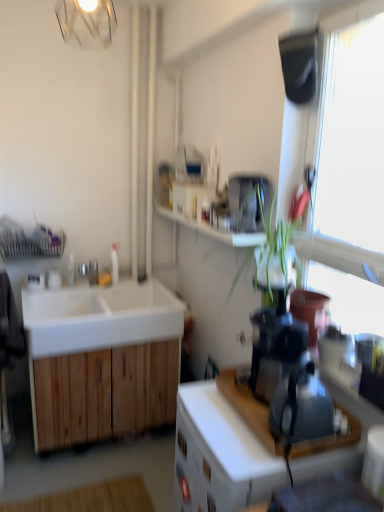
Question: Is white wood cabinet at left, the 1th cabinetry viewed from the back, positioned far away from transparent glass window at upper right?

Choices:
 (A) no
 (B) yes

Answer: (B)

Question: Considering the relative sizes of white wood cabinet at left, the 1th cabinetry viewed from the left, and transparent glass window at upper right in the image provided, is white wood cabinet at left, the 1th cabinetry viewed from the left, thinner than transparent glass window at upper right?

Choices:
 (A) yes
 (B) no

Answer: (B)

Question: From a real-world perspective, is white wood cabinet at left, which ranks as the 2th cabinetry in front-to-back order, physically above transparent glass window at upper right?

Choices:
 (A) no
 (B) yes

Answer: (A)

Question: Is white wood cabinet at left, the 1th cabinetry viewed from the back, surrounding transparent glass window at upper right?

Choices:
 (A) yes
 (B) no

Answer: (B)

Question: Is white wood cabinet at left, the 1th cabinetry viewed from the left, wider than transparent glass window at upper right?

Choices:
 (A) yes
 (B) no

Answer: (A)

Question: Is white wood cabinet at left, the 1th cabinetry viewed from the back, to the left of transparent glass window at upper right from the viewer's perspective?

Choices:
 (A) no
 (B) yes

Answer: (B)

Question: From the image's perspective, would you say transparent glass window at upper right is positioned over black plastic blender at right, which is the 2th appliance from back to front?

Choices:
 (A) yes
 (B) no

Answer: (A)

Question: Is transparent glass window at upper right in front of black plastic blender at right, the first appliance positioned from the front?

Choices:
 (A) yes
 (B) no

Answer: (A)

Question: Does transparent glass window at upper right have a lesser width compared to black plastic blender at right, which is the 2th appliance from back to front?

Choices:
 (A) yes
 (B) no

Answer: (A)

Question: Is transparent glass window at upper right looking in the opposite direction of black plastic blender at right, the first appliance positioned from the front?

Choices:
 (A) yes
 (B) no

Answer: (B)

Question: Considering the relative positions of transparent glass window at upper right and black plastic blender at right, which is the 2th appliance from back to front, in the image provided, is transparent glass window at upper right to the right of black plastic blender at right, which is the 2th appliance from back to front, from the viewer's perspective?

Choices:
 (A) yes
 (B) no

Answer: (A)

Question: Does transparent glass window at upper right have a greater height compared to black plastic blender at right, the first appliance positioned from the front?

Choices:
 (A) no
 (B) yes

Answer: (B)

Question: Is white wood cabinet at center, arranged as the 1th cabinetry when viewed from the front, taller than white matte sink at left?

Choices:
 (A) no
 (B) yes

Answer: (B)